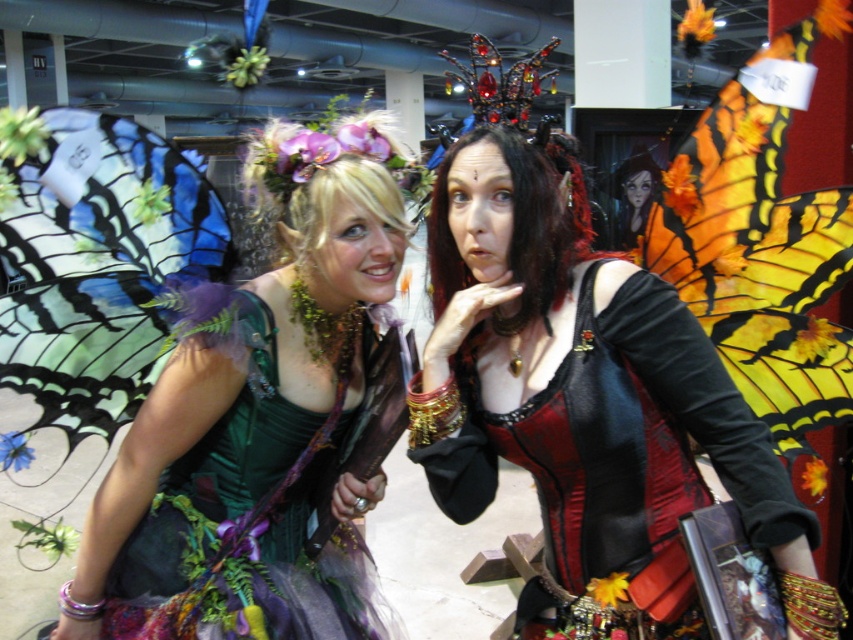
You are a photographer at the event and need to capture a photo where both the matte black corset at center and the translucent blue fabric butterfly at left are clearly visible. Considering their sizes, which object should you focus on first to ensure proper framing?

The matte black corset at center has a greater height compared to the translucent blue fabric butterfly at left, so you should focus on the matte black corset at center first to ensure it fits within the frame before adjusting for the smaller butterfly.

You are an event photographer at the themed event. You need to capture a photo of the green velvet dress at left and the translucent blue fabric butterfly at left. Based on their positions, which object is closer to the camera?

The green velvet dress at left is positioned under the translucent blue fabric butterfly at left, so the butterfly is closer to the camera.

You are standing in the center of the hall. You need to locate the green velvet dress at left. Based on its coordinates, which direction should you look to find it?

The green velvet dress at left is located at coordinates point [257,420], so you should look to the left side of the hall to find it.